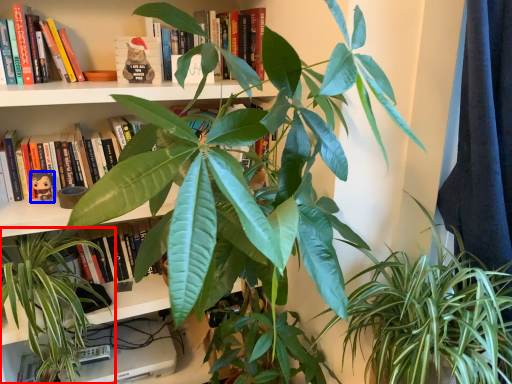
Question: Among these objects, which one is farthest to the camera, houseplant (highlighted by a red box) or toy (highlighted by a blue box)?

Choices:
 (A) houseplant
 (B) toy

Answer: (B)